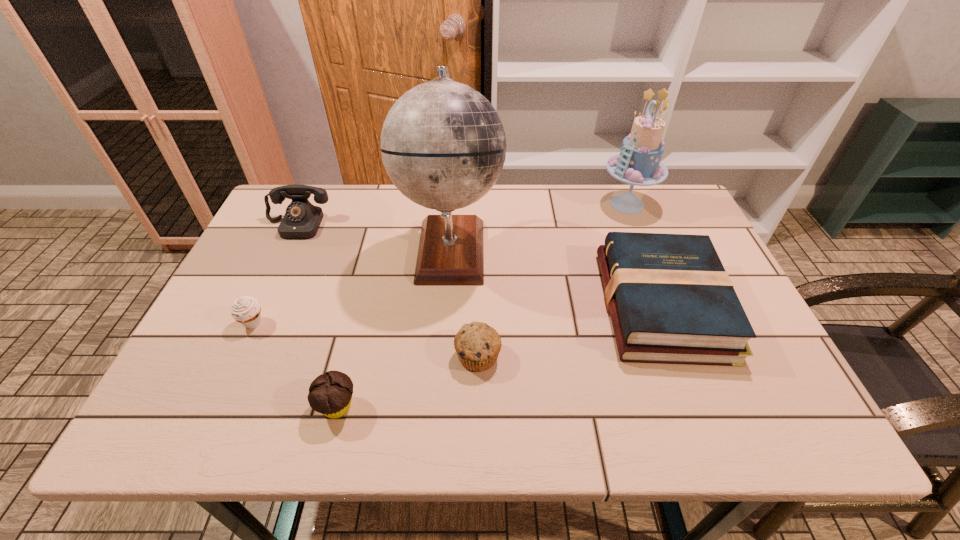
This screenshot has height=540, width=960. I want to click on free area in between the farthest muffin and the fifth shortest object, so 276,274.

Locate an element on the screen. This screenshot has height=540, width=960. free space between the fifth object from right to left and the tallest object is located at coordinates (394, 328).

Select which object is the fifth closest to the leftmost muffin. Please provide its 2D coordinates. Your answer should be formatted as a tuple, i.e. [(x, y)], where the tuple contains the x and y coordinates of a point satisfying the conditions above.

[(671, 301)]

Select which object is the closest to the nearest muffin. Please provide its 2D coordinates. Your answer should be formatted as a tuple, i.e. [(x, y)], where the tuple contains the x and y coordinates of a point satisfying the conditions above.

[(477, 344)]

Identify which muffin is the second nearest to the second tallest object. Please provide its 2D coordinates. Your answer should be formatted as a tuple, i.e. [(x, y)], where the tuple contains the x and y coordinates of a point satisfying the conditions above.

[(330, 394)]

Where is `the closest muffin to the farthest muffin`? Image resolution: width=960 pixels, height=540 pixels. the closest muffin to the farthest muffin is located at coordinates (330, 394).

Image resolution: width=960 pixels, height=540 pixels. I want to click on vacant space that satisfies the following two spatial constraints: 1. on the dial of the fifth object from right to left; 2. on the left side of the third tallest object, so click(212, 407).

Where is `blank area in the image that satisfies the following two spatial constraints: 1. at the equator of the globe; 2. on the back side of the hardback book`? This screenshot has width=960, height=540. blank area in the image that satisfies the following two spatial constraints: 1. at the equator of the globe; 2. on the back side of the hardback book is located at coordinates (446, 305).

Locate an element on the screen. This screenshot has height=540, width=960. vacant space that satisfies the following two spatial constraints: 1. at the equator of the second farthest muffin; 2. on the right side of the globe is located at coordinates (443, 356).

Locate an element on the screen. free location that satisfies the following two spatial constraints: 1. at the equator of the globe; 2. on the back side of the hardback book is located at coordinates click(x=446, y=305).